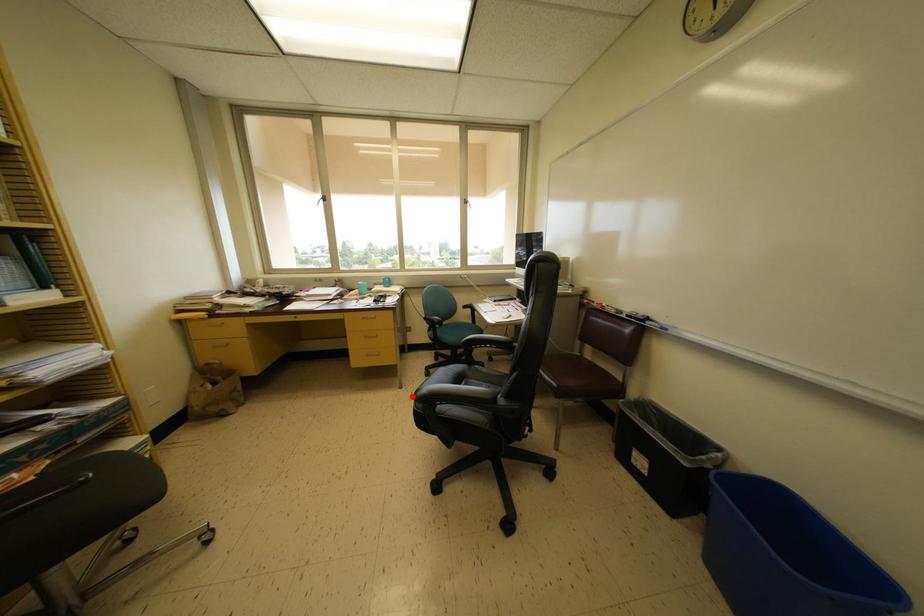
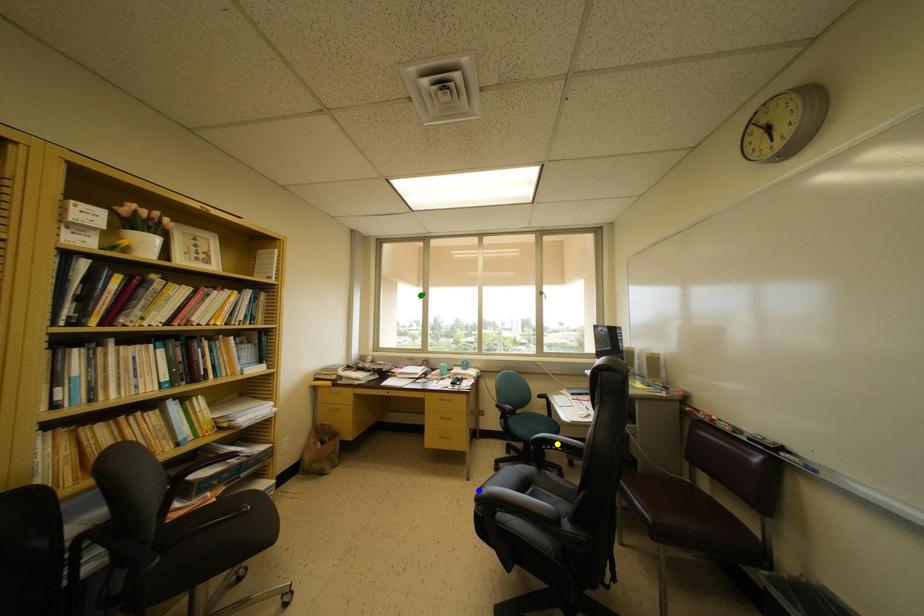
Question: I am providing you with two images of the same scene from different viewpoints. A red point is marked on the first image. You are given multiple points on the second image. In image 2, which mark is for the same physical point as the one in image 1?

Choices:
 (A) green point
 (B) yellow point
 (C) blue point

Answer: (C)